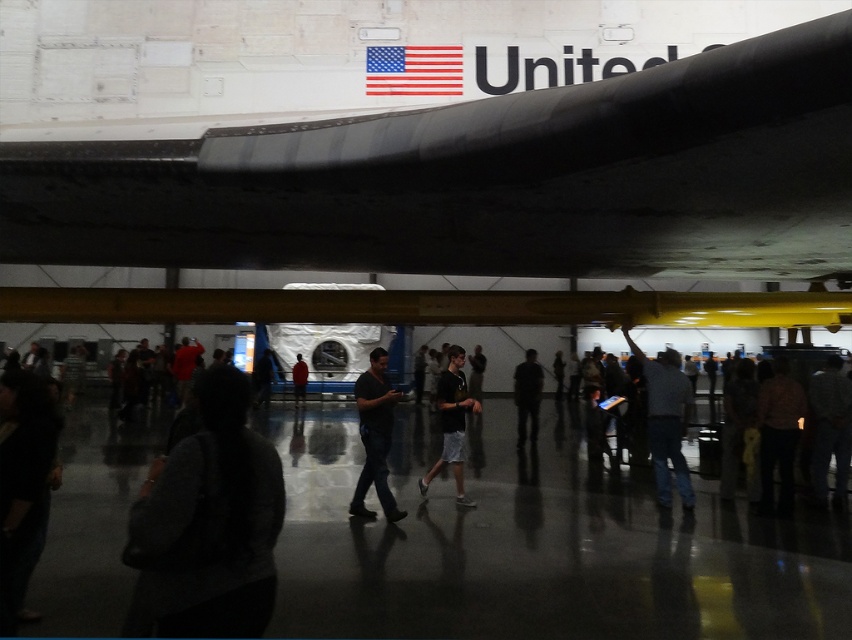
Is black matte shirt at center to the left of red shirt at center from the viewer's perspective?

Incorrect, black matte shirt at center is not on the left side of red shirt at center.

Is point (386, 410) closer to viewer compared to point (292, 380)?

Yes, point (386, 410) is in front of point (292, 380).

What are the coordinates of `black matte shirt at center` in the screenshot? It's located at (375, 436).

Is denim jeans at center above dark gray shorts at center?

Correct, denim jeans at center is located above dark gray shorts at center.

Identify the location of denim jeans at center. (665, 419).

How much distance is there between denim jeans at center and black matte shirt at center?

They are 16.96 feet apart.

Between denim jeans at center and black matte shirt at center, which one appears on the right side from the viewer's perspective?

From the viewer's perspective, denim jeans at center appears more on the right side.

Is point (665, 445) farther from camera compared to point (371, 516)?

Yes, point (665, 445) is farther from viewer.

Where is `denim jeans at center`? This screenshot has width=852, height=640. denim jeans at center is located at coordinates (665, 419).